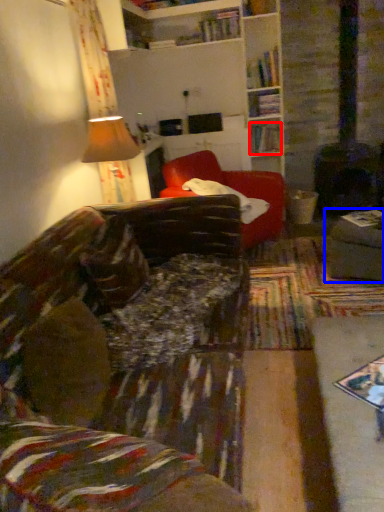
Question: Which point is closer to the camera, book (highlighted by a red box) or gray (highlighted by a blue box)?

Choices:
 (A) book
 (B) gray

Answer: (B)